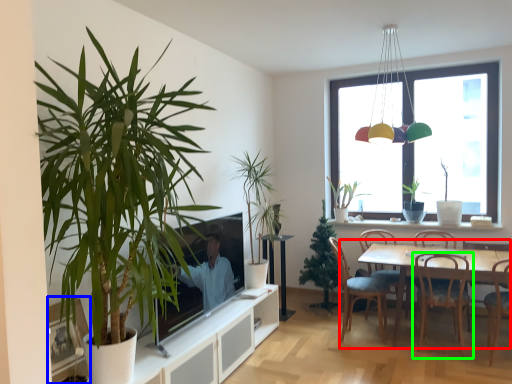
Question: Which object is the farthest from kitchen & dining room table (highlighted by a red box)? Choose among these: picture frame (highlighted by a blue box) or chair (highlighted by a green box).

Choices:
 (A) picture frame
 (B) chair

Answer: (A)